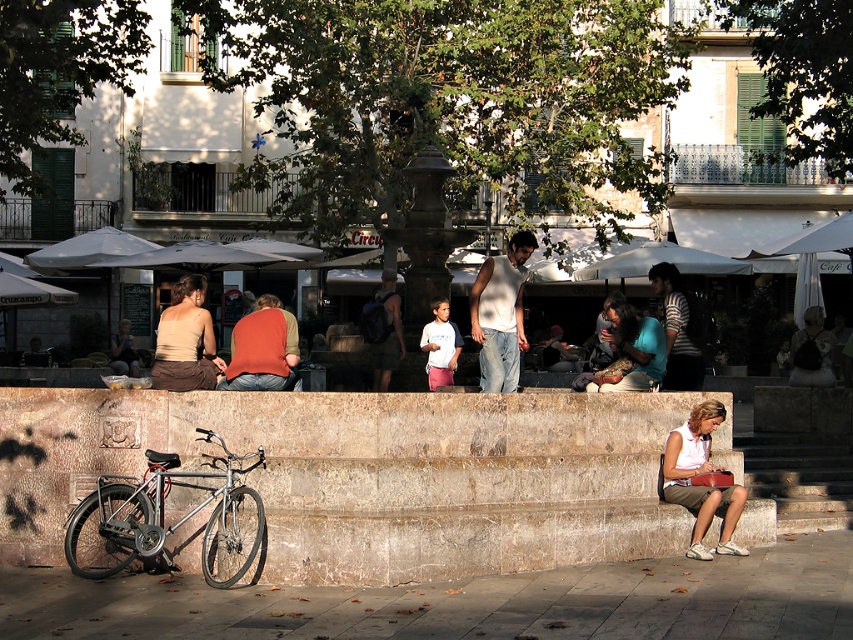
You are a photographer standing in the town square and want to capture a photo of both the white cotton blouse at lower right and the matte black hair at center. Which object should you position to the right side of your frame to include both in the shot?

You should position the white cotton blouse at lower right to the right side of your frame since it is already to the right of the matte black hair at center.

What is the location of the point at coordinates (373, 474) in the image?

The point at coordinates (373, 474) corresponds to the marble steps at center.

You are standing at the base of the marble steps at center and want to reach the matte black hair at center. Which direction should you move to get closer?

You should move upward because the marble steps at center is below matte black hair at center.